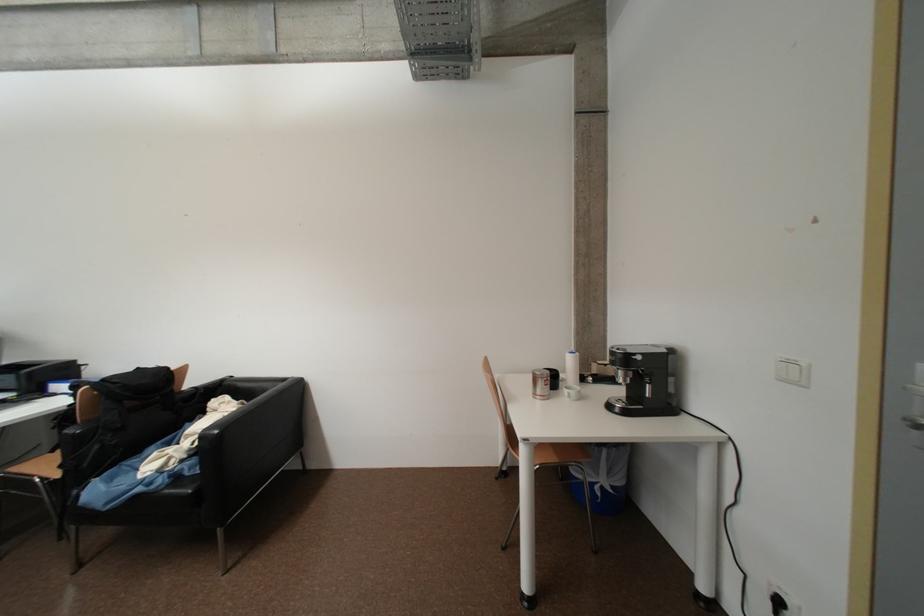
Find the location of a particular element. The width and height of the screenshot is (924, 616). light switch rocker is located at coordinates (793, 371).